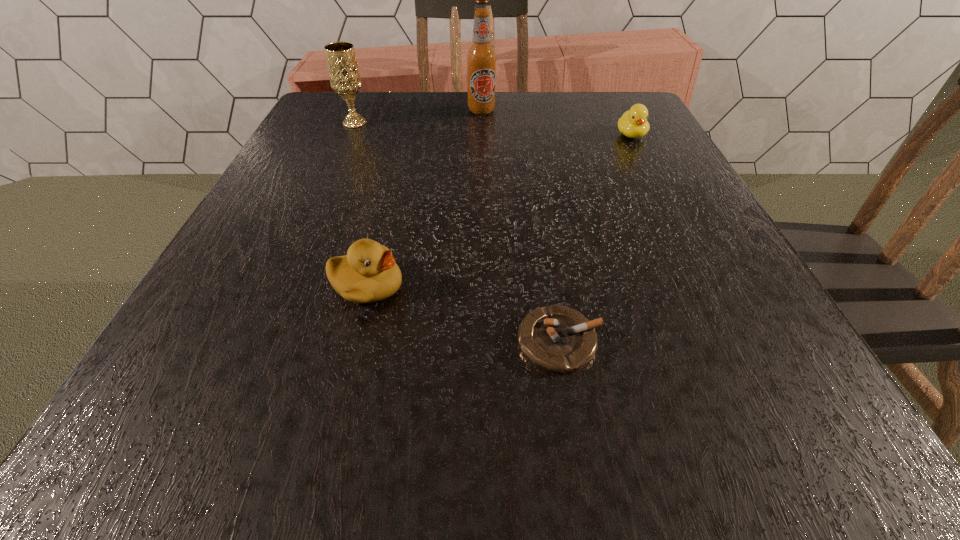
Where is `free space located 0.240m on the front label of the third object from left to right`? Image resolution: width=960 pixels, height=540 pixels. free space located 0.240m on the front label of the third object from left to right is located at coordinates (482, 171).

Locate an element on the screen. Image resolution: width=960 pixels, height=540 pixels. vacant position located on the right of the chalice is located at coordinates pyautogui.click(x=403, y=124).

Where is `vacant space located on the front-facing side of the left duckling`? This screenshot has width=960, height=540. vacant space located on the front-facing side of the left duckling is located at coordinates (456, 286).

Where is `free space located on the beak of the second shortest object`? free space located on the beak of the second shortest object is located at coordinates (658, 188).

This screenshot has height=540, width=960. In order to click on vacant position located on the right of the second object from right to left in this screenshot , I will do coord(699,341).

Find the location of `beer bottle that is positioned at the far edge`. beer bottle that is positioned at the far edge is located at coordinates (481, 57).

Locate an element on the screen. This screenshot has height=540, width=960. chalice situated at the far edge is located at coordinates (344, 75).

Identify the location of duckling that is positioned at the far edge. (633, 123).

Locate an element on the screen. object that is at the left edge is located at coordinates (344, 75).

The height and width of the screenshot is (540, 960). I want to click on object present at the right edge, so click(633, 123).